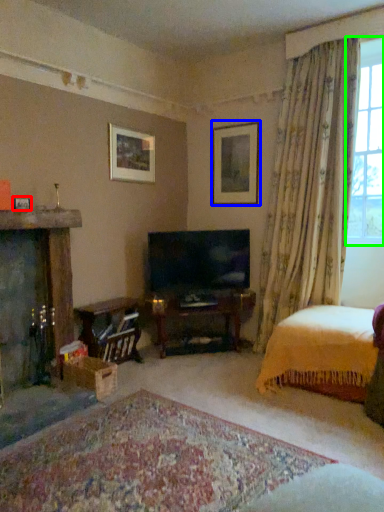
Question: Which is nearer to the picture frame (highlighted by a red box)? picture frame (highlighted by a blue box) or window (highlighted by a green box).

Choices:
 (A) picture frame
 (B) window

Answer: (A)